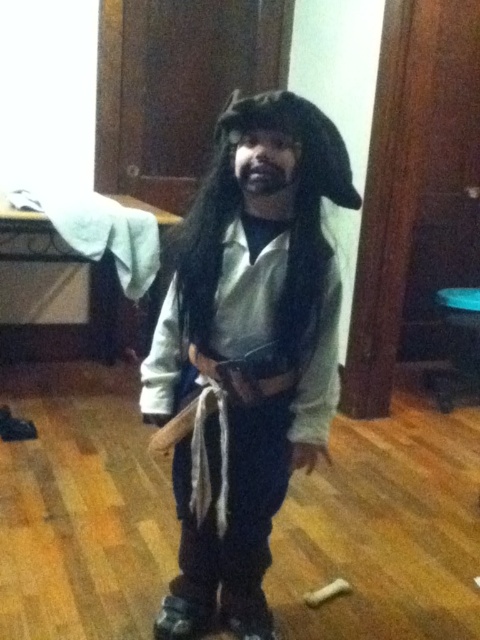
Question: Observing the image, what is the correct spatial positioning of white matte pirate costume at center in reference to black matte beard at center?

Choices:
 (A) below
 (B) above

Answer: (A)

Question: Which point appears farthest from the camera in this image?

Choices:
 (A) (280, 188)
 (B) (215, 372)

Answer: (B)

Question: Is white matte pirate costume at center above black matte beard at center?

Choices:
 (A) yes
 (B) no

Answer: (B)

Question: Which point is farther from the camera taking this photo?

Choices:
 (A) (203, 248)
 (B) (264, 156)

Answer: (A)

Question: Is white matte pirate costume at center wider than black matte beard at center?

Choices:
 (A) yes
 (B) no

Answer: (A)